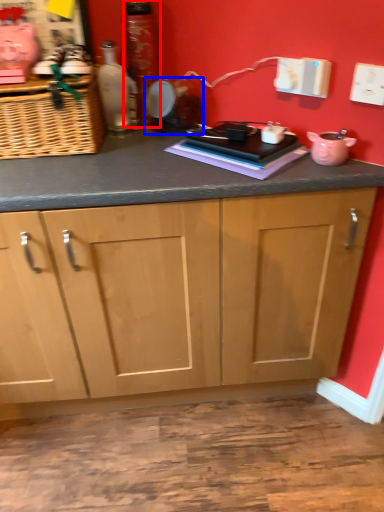
Question: Which object appears farthest to the camera in this image, bottle (highlighted by a red box) or appliance (highlighted by a blue box)?

Choices:
 (A) bottle
 (B) appliance

Answer: (A)